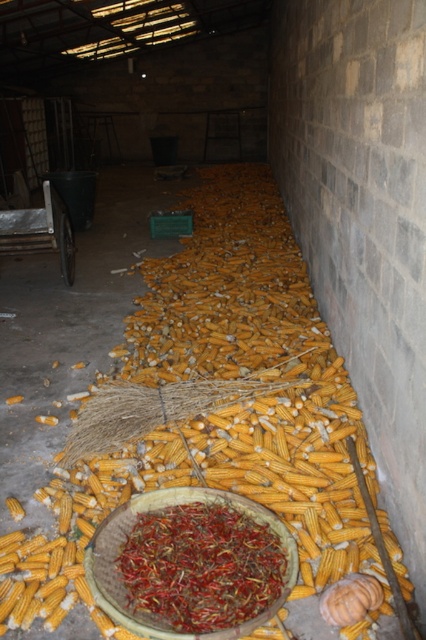
You are standing in the storage area and want to pick up an item. Which point, point (264,596) or point (31,209), is closer to you?

Point (264,596) is closer to the camera than point (31,209), so you should pick up the item at point (264,596) first since it is closer to you.

You are a farmer who wants to store the yellow matte corn at center and the red dried chili at center in separate containers. Which object should you place in the taller container to accommodate its height?

The red dried chili at center is taller than the yellow matte corn at center, so you should place the red dried chili at center in the taller container to accommodate its height.